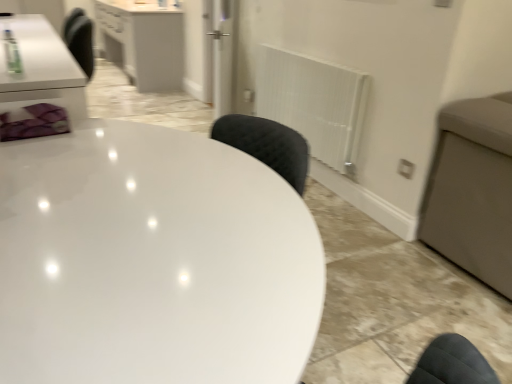
Question: Does point (89, 349) appear closer or farther from the camera than point (129, 51)?

Choices:
 (A) farther
 (B) closer

Answer: (B)

Question: Looking at their shapes, would you say white glossy table at center is wider or thinner than white glossy cabinet at upper left?

Choices:
 (A) thin
 (B) wide

Answer: (B)

Question: Which object is positioned closest to the transparent glass door at center?

Choices:
 (A) white glossy cabinet at upper left
 (B) white glossy table at center
 (C) white textured radiator at center right

Answer: (A)

Question: Which is farther from the white glossy table at center?

Choices:
 (A) white textured radiator at center right
 (B) transparent glass door at center
 (C) white glossy cabinet at upper left

Answer: (C)